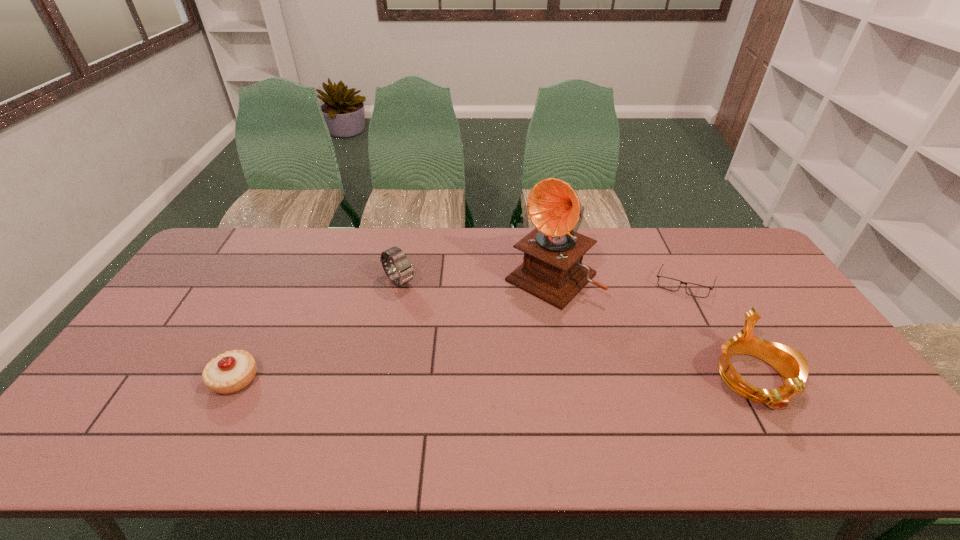
Find the location of a particular element. empty location between the fourth object from right to left and the leftmost object is located at coordinates (317, 330).

Point out which object is positioned as the third nearest to the phonograph record. Please provide its 2D coordinates. Your answer should be formatted as a tuple, i.e. [(x, y)], where the tuple contains the x and y coordinates of a point satisfying the conditions above.

[(405, 273)]

Select which object is the closest to the fourth object from right to left. Please provide its 2D coordinates. Your answer should be formatted as a tuple, i.e. [(x, y)], where the tuple contains the x and y coordinates of a point satisfying the conditions above.

[(552, 270)]